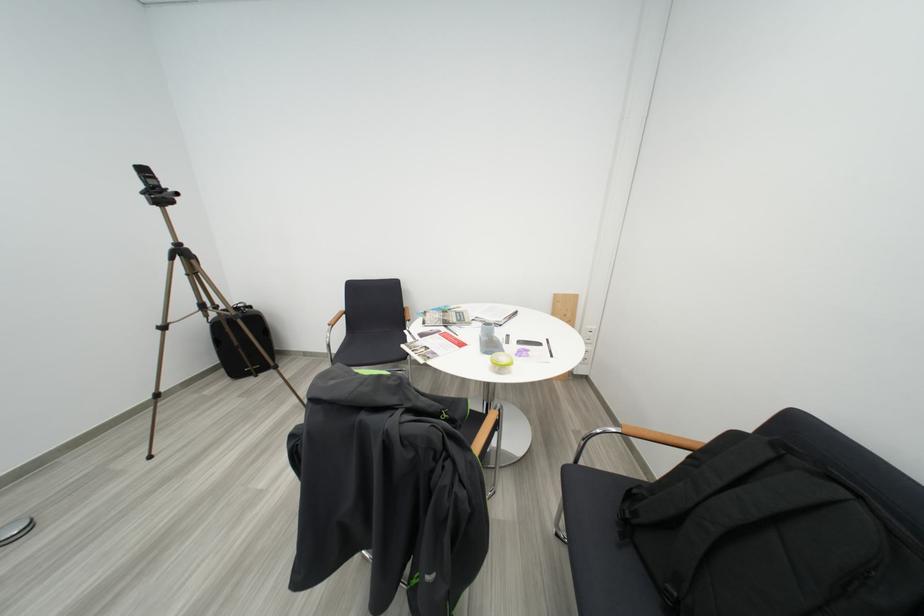
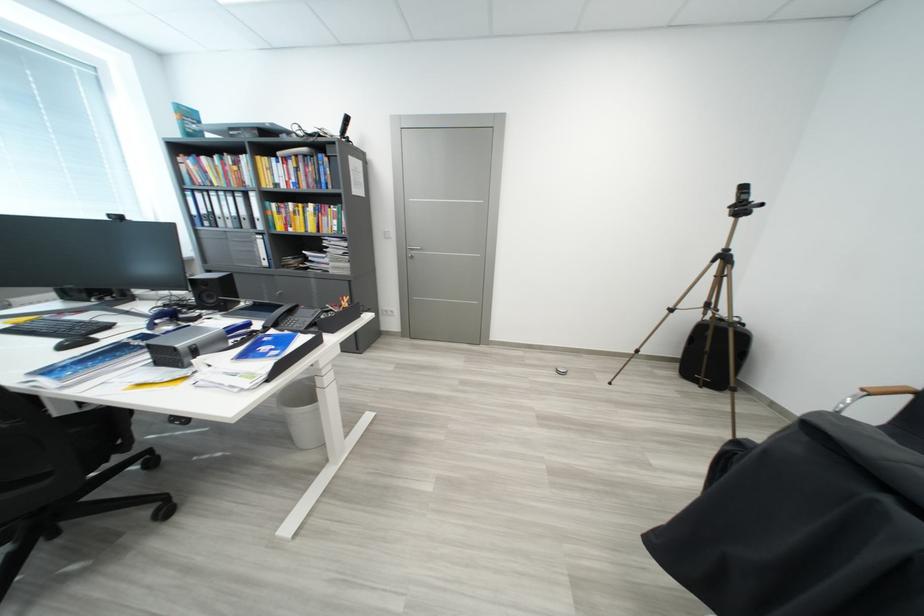
The images are taken continuously from a first-person perspective. In which direction is your viewpoint rotating?

The camera rotated toward left-down.